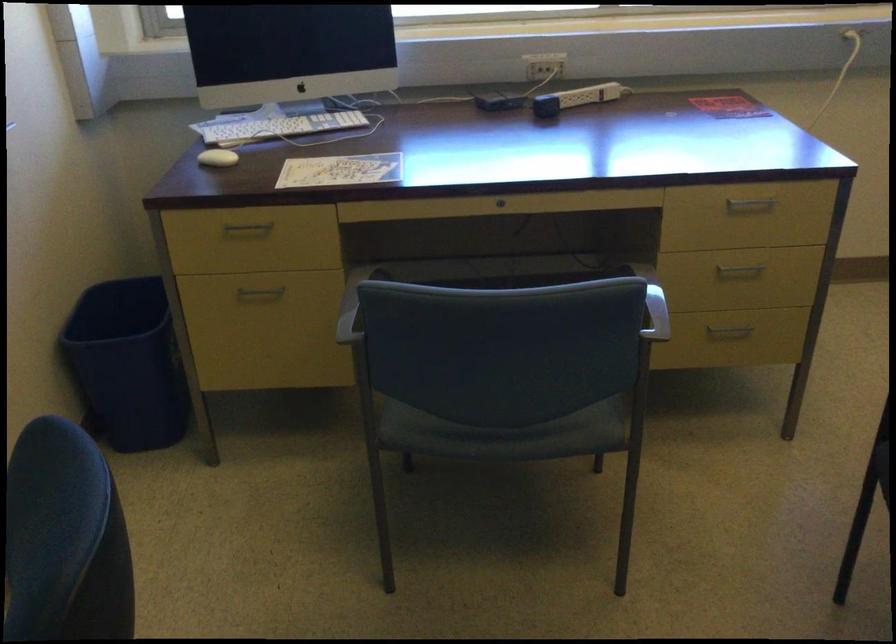
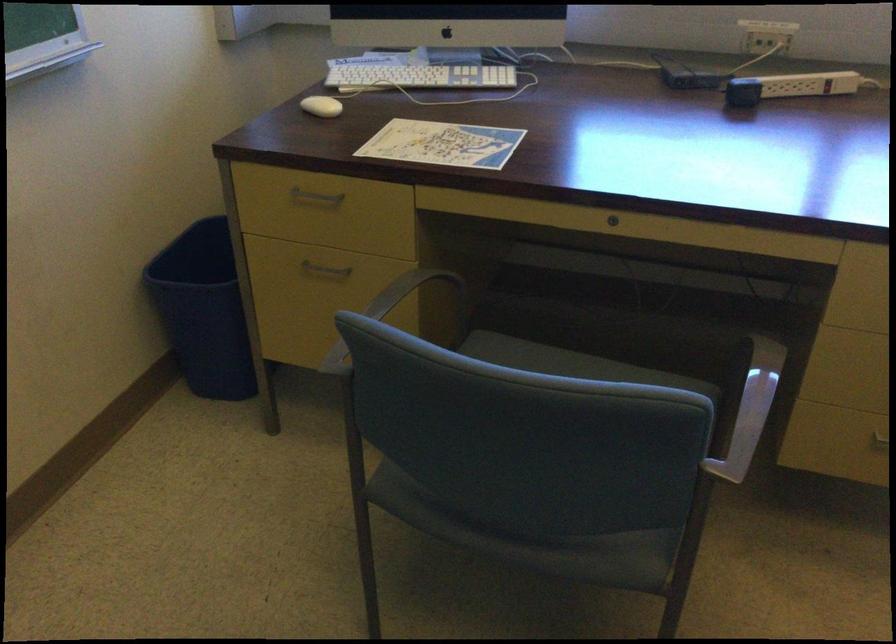
Find the pixel in the second image that matches (221,158) in the first image.

(321, 106)